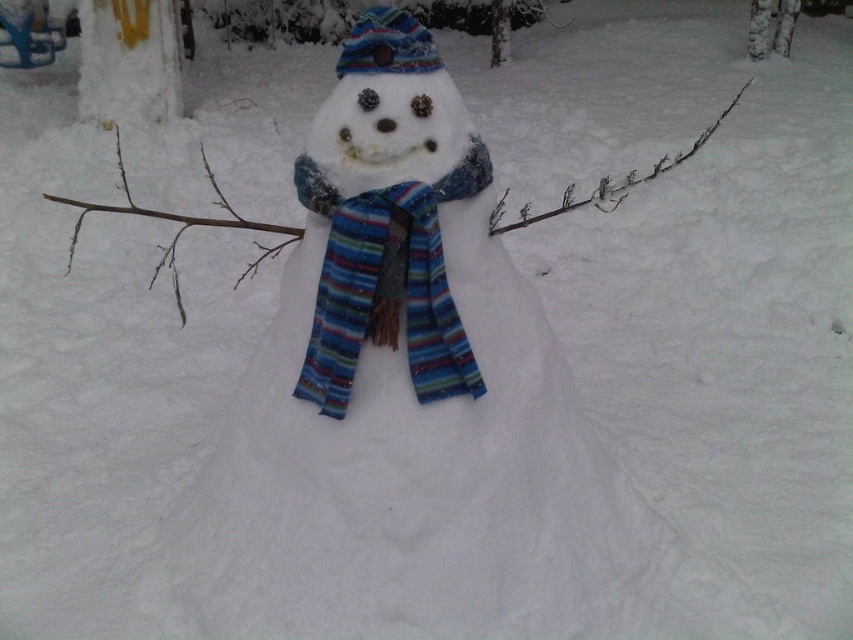
From the picture: You are a winter clothing designer observing the snowman. You need to decide which item has a greater width between the striped wool scarf at center and the striped woolen hat at center. Which one is wider?

The striped wool scarf at center is wider than the striped woolen hat at center according to the description.